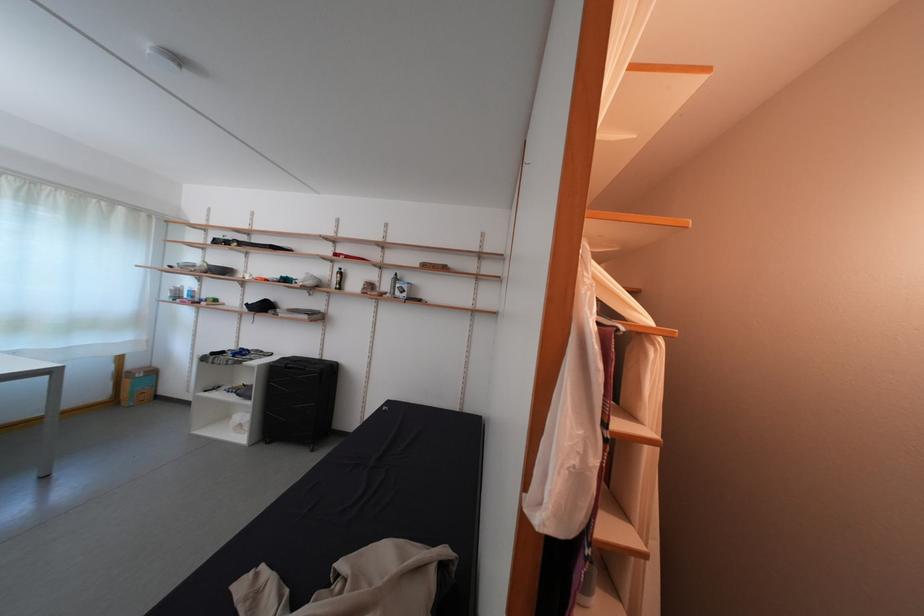
This screenshot has width=924, height=616. In order to click on grey bowl in this screenshot , I will do `click(219, 270)`.